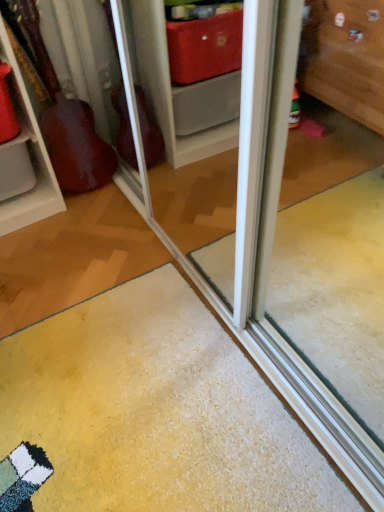
This screenshot has height=512, width=384. I want to click on free space above yellow carpet at lower center (from a real-world perspective), so click(x=196, y=286).